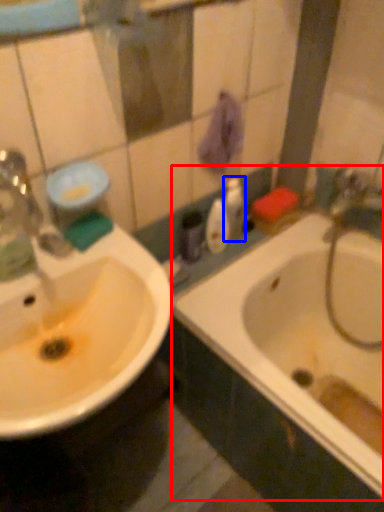
Question: Which object is further to the camera taking this photo, bathtub (highlighted by a red box) or toiletry (highlighted by a blue box)?

Choices:
 (A) bathtub
 (B) toiletry

Answer: (B)